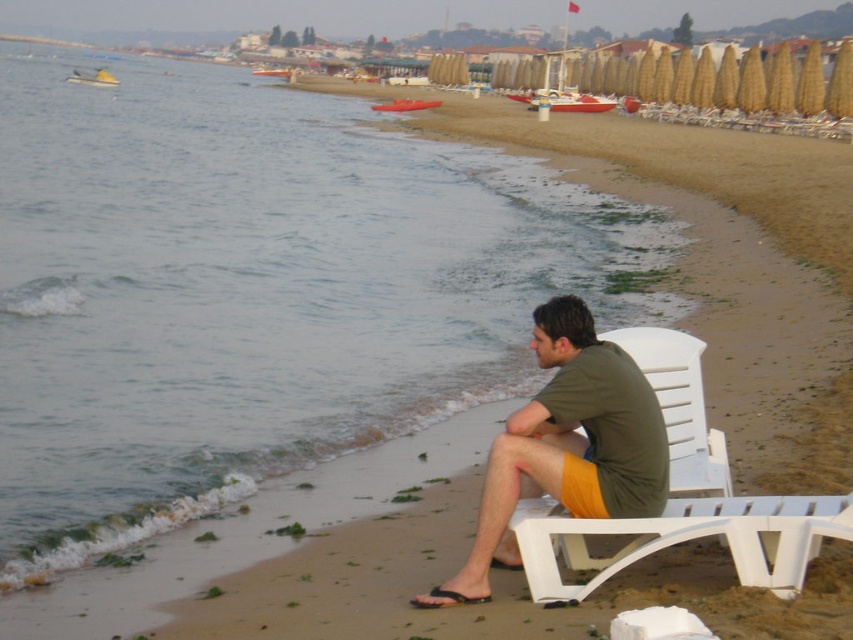
Question: Which object is farther from the camera taking this photo?

Choices:
 (A) black rubber sandal at lower center
 (B) clear water at beach left
 (C) white plastic beach chair at lower right
 (D) green matte shirt at center

Answer: (B)

Question: Which point is farther to the camera?

Choices:
 (A) clear water at beach left
 (B) green matte shirt at center
 (C) white plastic beach chair at lower right
 (D) black rubber sandal at lower center

Answer: (A)

Question: Does green matte shirt at center have a greater width compared to white plastic beach chair at lower right?

Choices:
 (A) yes
 (B) no

Answer: (B)

Question: Which point is closer to the camera taking this photo?

Choices:
 (A) (296, 312)
 (B) (463, 595)

Answer: (B)

Question: Is green matte shirt at center wider than black rubber sandal at lower center?

Choices:
 (A) yes
 (B) no

Answer: (A)

Question: Can you confirm if clear water at beach left is positioned to the right of white plastic beach chair at lower right?

Choices:
 (A) yes
 (B) no

Answer: (B)